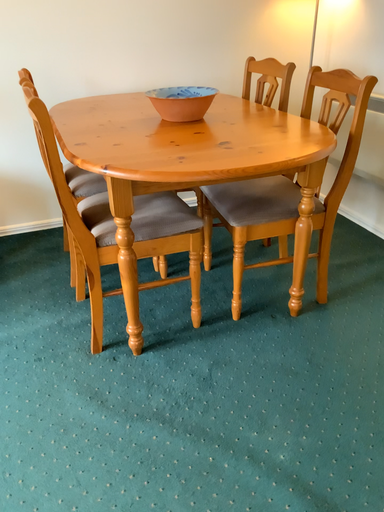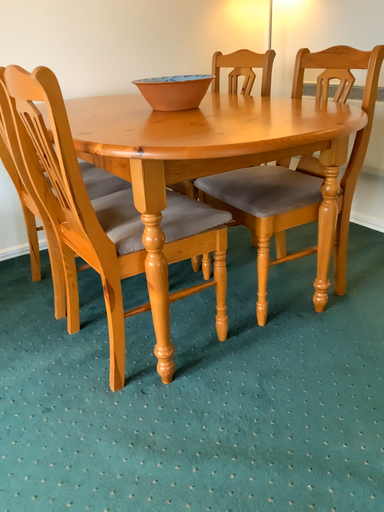
Question: Which way did the camera rotate in the video?

Choices:
 (A) rotated left
 (B) rotated right

Answer: (B)